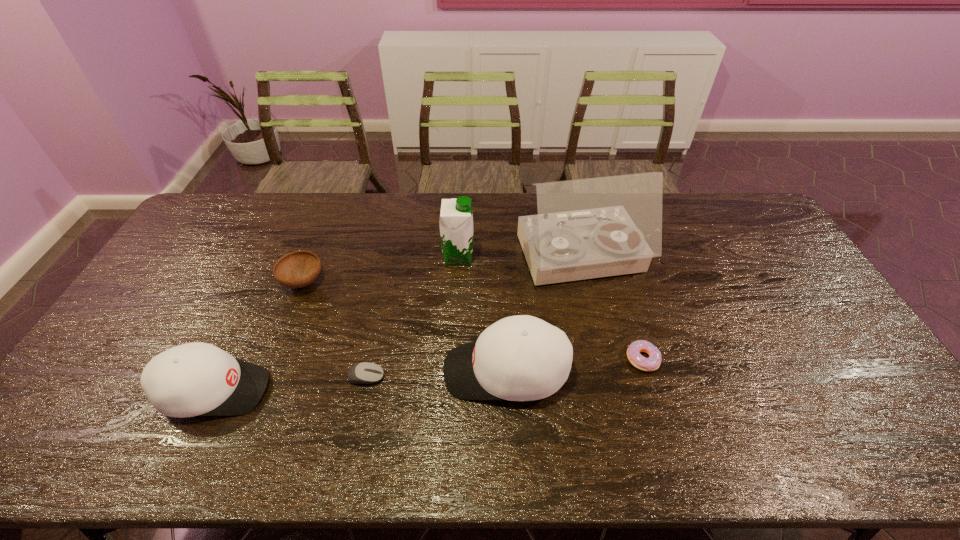
Where is `vacant space at the far edge of the desktop`? This screenshot has height=540, width=960. vacant space at the far edge of the desktop is located at coordinates pyautogui.click(x=516, y=225).

The image size is (960, 540). Find the location of `blank space at the near edge of the desktop`. blank space at the near edge of the desktop is located at coordinates (317, 390).

Image resolution: width=960 pixels, height=540 pixels. I want to click on free space at the right edge of the desktop, so click(751, 254).

This screenshot has width=960, height=540. What are the coordinates of `vacant space at the far left corner of the desktop` in the screenshot? It's located at (223, 201).

In the image, there is a desktop. Where is `free space at the near right corner`? free space at the near right corner is located at coordinates (831, 388).

Where is `free space between the tallest object and the fifth tallest object`? free space between the tallest object and the fifth tallest object is located at coordinates (442, 270).

At what (x,y) coordinates should I click in order to perform the action: click on free space between the computer equipment and the third shortest object. Please return your answer as a coordinate pair (x, y). This screenshot has height=540, width=960. Looking at the image, I should click on [x=335, y=329].

Find the location of `unoccupied area between the third tallest object and the third object from left to right`. unoccupied area between the third tallest object and the third object from left to right is located at coordinates (436, 374).

You are a GUI agent. You are given a task and a screenshot of the screen. Output one action in this format:
    pyautogui.click(x=<x>, y=<y>)
    Task: Click on the vacant area that lies between the second tallest object and the record player
    
    Given the screenshot: What is the action you would take?
    pyautogui.click(x=519, y=258)

Where is `empty location between the fifth tallest object and the tallest object`? The width and height of the screenshot is (960, 540). empty location between the fifth tallest object and the tallest object is located at coordinates point(442,270).